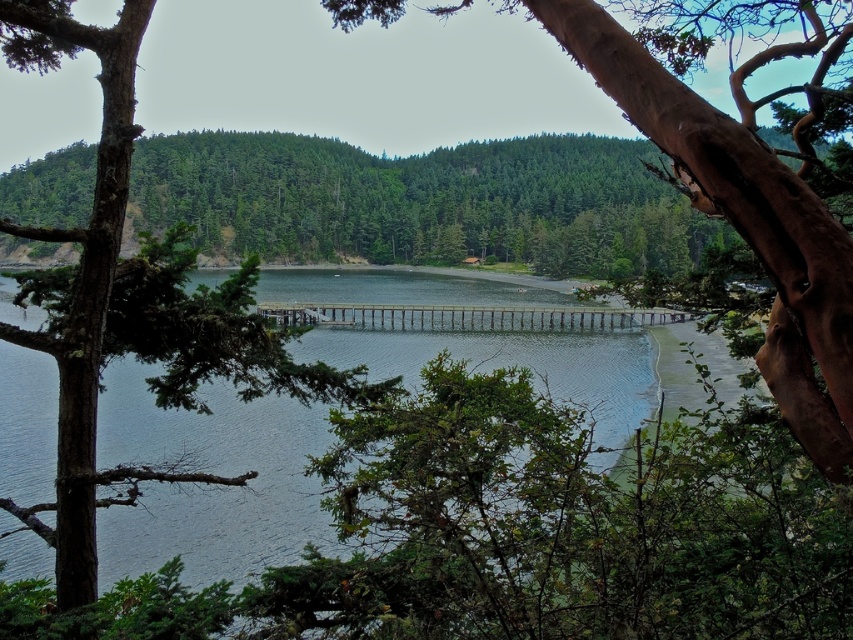
Does point (444, 291) come farther from viewer compared to point (798, 125)?

That is True.

Is point (364, 339) in front of point (811, 22)?

That is False.

The height and width of the screenshot is (640, 853). I want to click on clear water at center, so click(x=207, y=484).